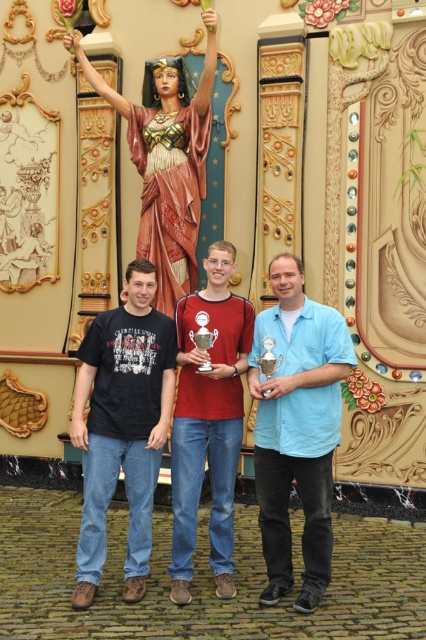
Based on the photo, you are standing at the center of the cobblestone surface in front of the statue. You need to locate the matte red shirt at center. According to the coordinates given, where should you look relative to your current position?

The matte red shirt at center is located at coordinates point [207,420]. Since you are at the center, which is typically considered as point [213,320], the red shirt is slightly to the right and above your current position.

You are standing in front of the ornate backdrop with the statue of a woman holding a torch. You want to take a photo of the blue cotton shirt at center from a distance that allows you to capture the entire statue in the background. The camera you have can focus on subjects up to 5 meters away. Will you be able to take the photo without moving closer?

The blue cotton shirt at center and camera are 6.20 meters apart. Since the camera can focus up to 5 meters, the distance is too far. You will need to move closer to ensure the blue cotton shirt at center is within the camera range.

You are standing in front of the ornate backdrop and see the matte red shirt at center and the wooden statue at center. Which object is located to the right of the other?

The matte red shirt at center is positioned on the right side of wooden statue at center.